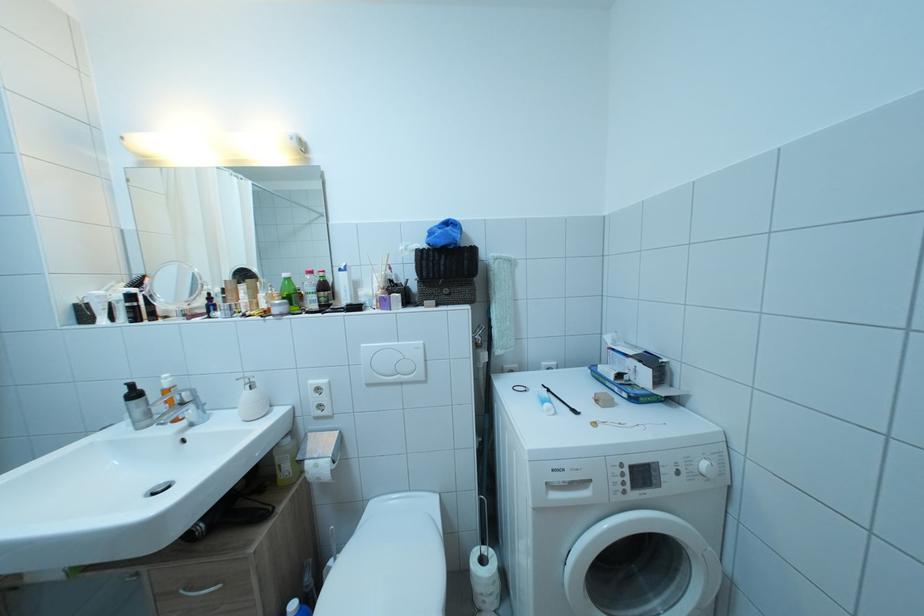
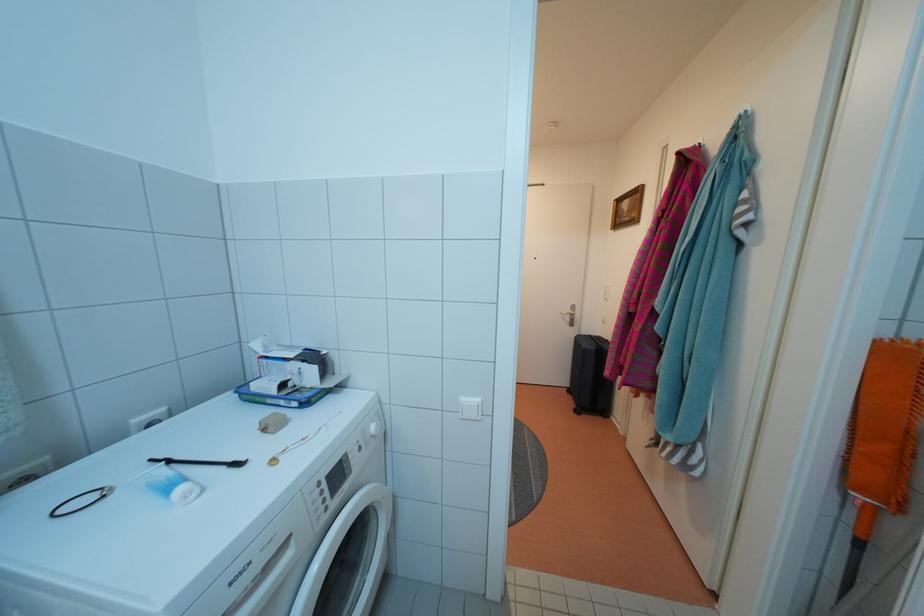
Where in the second image is the point corresponding to (650,480) from the first image?

(345, 482)